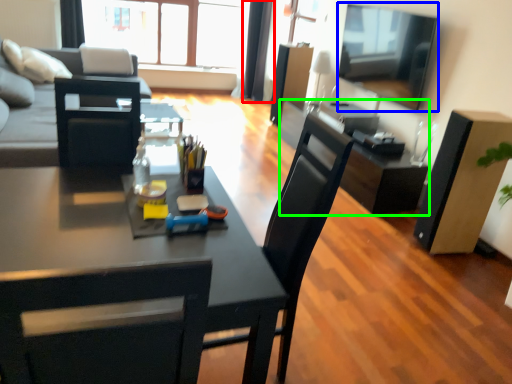
Question: Which object is the closest to the curtain (highlighted by a red box)? Choose among these: television (highlighted by a blue box) or computer desk (highlighted by a green box).

Choices:
 (A) television
 (B) computer desk

Answer: (A)